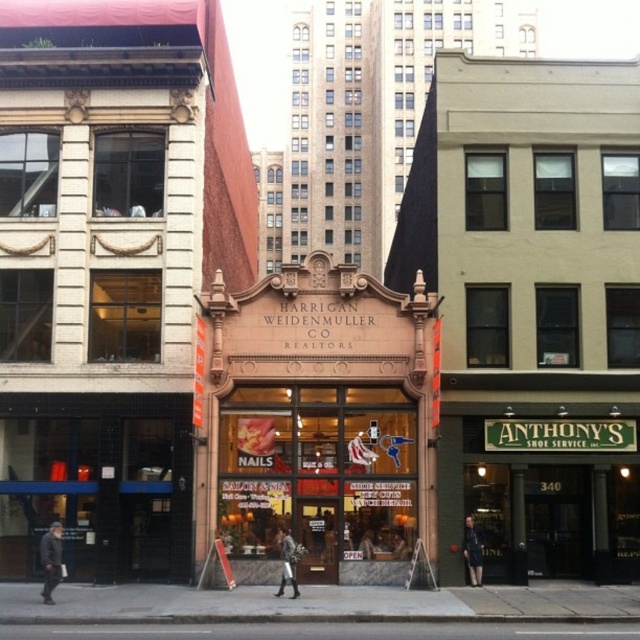
Question: Which object is positioned closest to the matte pink storefront at center?

Choices:
 (A) leather jacket at center
 (B) dark gray jacket at lower left

Answer: (A)

Question: Does dark blue fabric coat at center have a lesser width compared to leather jacket at center?

Choices:
 (A) no
 (B) yes

Answer: (B)

Question: Does dark gray jacket at lower left have a lesser width compared to leather jacket at center?

Choices:
 (A) yes
 (B) no

Answer: (A)

Question: Which is farther from the dark blue fabric coat at center?

Choices:
 (A) dark gray jacket at lower left
 (B) leather jacket at center

Answer: (A)

Question: Can you confirm if matte pink storefront at center is positioned below leather jacket at center?

Choices:
 (A) no
 (B) yes

Answer: (A)

Question: Which point is closer to the camera?

Choices:
 (A) (380, 492)
 (B) (470, 561)
 (C) (292, 548)

Answer: (C)